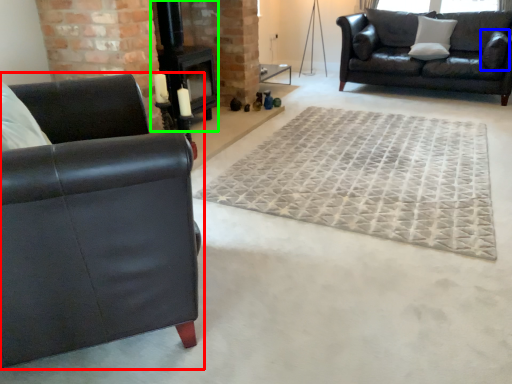
Question: Which object is positioned farthest from studio couch (highlighted by a red box)? Select from pillow (highlighted by a blue box) and fireplace (highlighted by a green box).

Choices:
 (A) pillow
 (B) fireplace

Answer: (A)